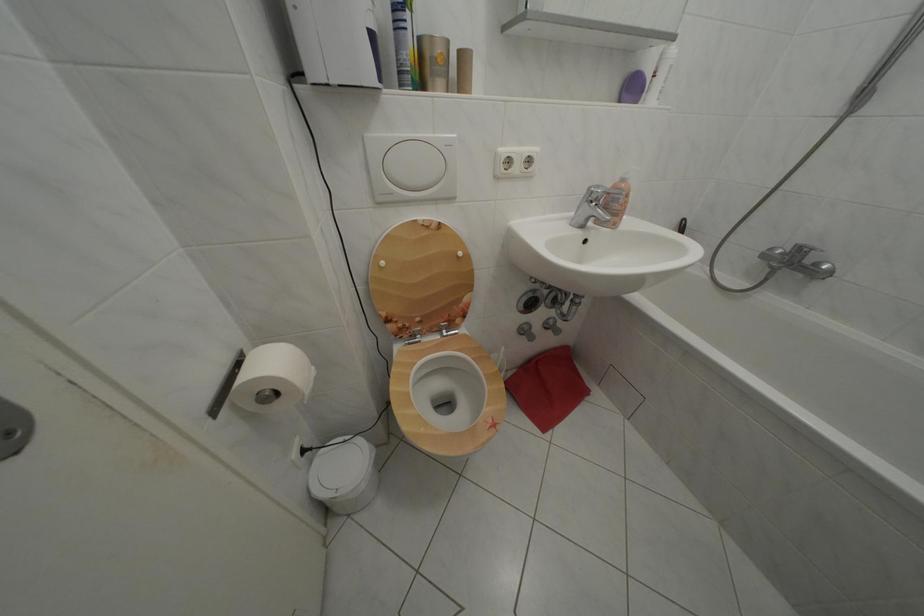
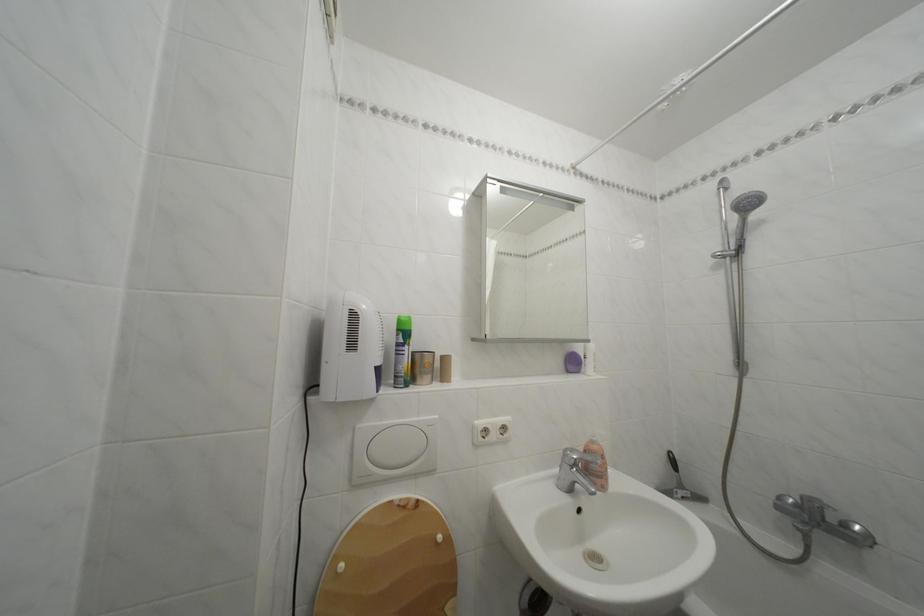
Locate, in the second image, the point that corresponds to [792,260] in the first image.

(806, 512)